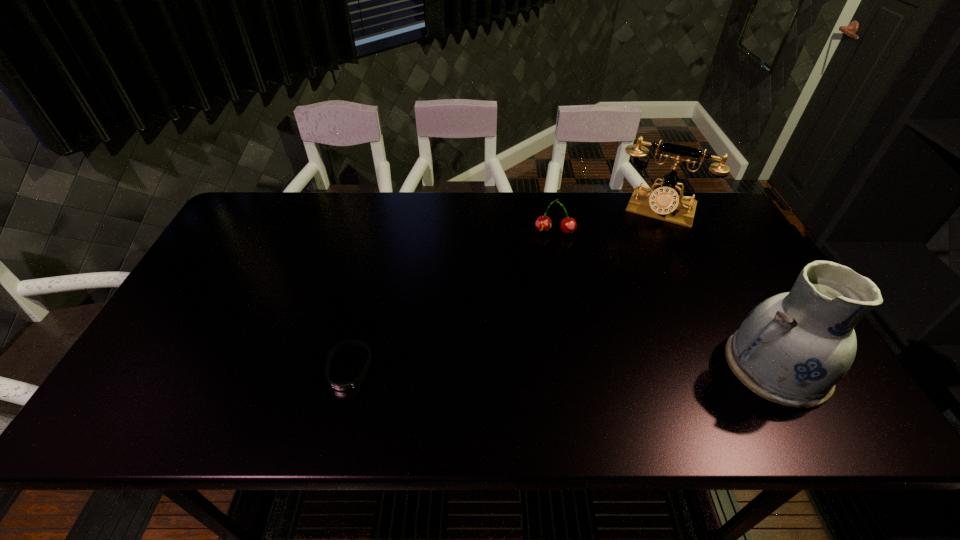
Where is `vacant space located 0.150m on the dial of the second tallest object`? The image size is (960, 540). vacant space located 0.150m on the dial of the second tallest object is located at coordinates (637, 254).

I want to click on vacant space located on the dial of the second tallest object, so click(x=629, y=280).

The width and height of the screenshot is (960, 540). What are the coordinates of `free space located 0.320m on the dial of the second tallest object` in the screenshot? It's located at (625, 292).

Where is `cherry that is at the far edge`? The width and height of the screenshot is (960, 540). cherry that is at the far edge is located at coordinates (568, 225).

In order to click on telephone situated at the far edge in this screenshot , I will do `click(664, 203)`.

Where is `wristband located at the near edge`? This screenshot has width=960, height=540. wristband located at the near edge is located at coordinates (341, 386).

The width and height of the screenshot is (960, 540). I want to click on pottery that is positioned at the near edge, so click(x=793, y=348).

Identify the location of pottery present at the right edge. This screenshot has height=540, width=960. (793, 348).

This screenshot has height=540, width=960. Find the location of `telephone that is at the right edge`. telephone that is at the right edge is located at coordinates [664, 203].

This screenshot has width=960, height=540. What are the coordinates of `object present at the far right corner` in the screenshot? It's located at (664, 203).